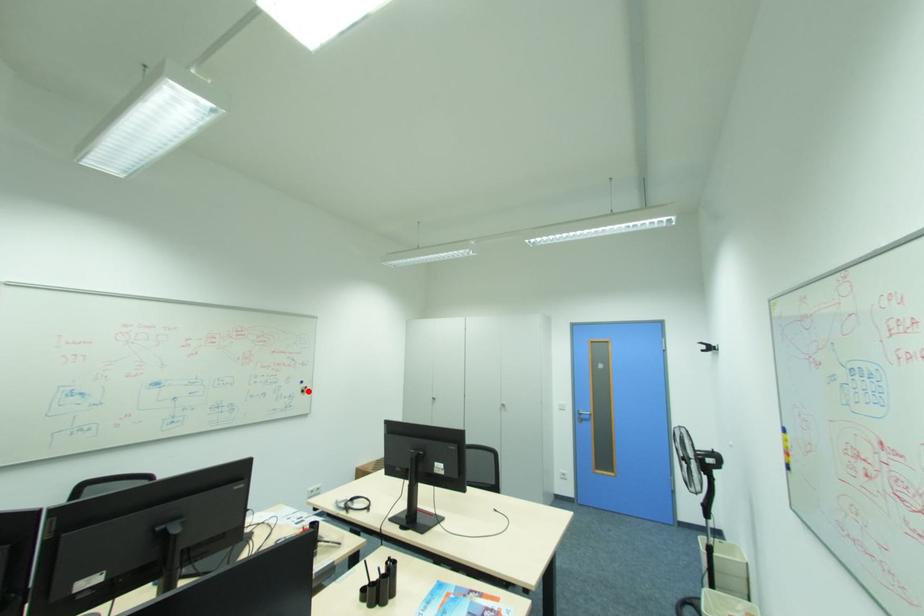
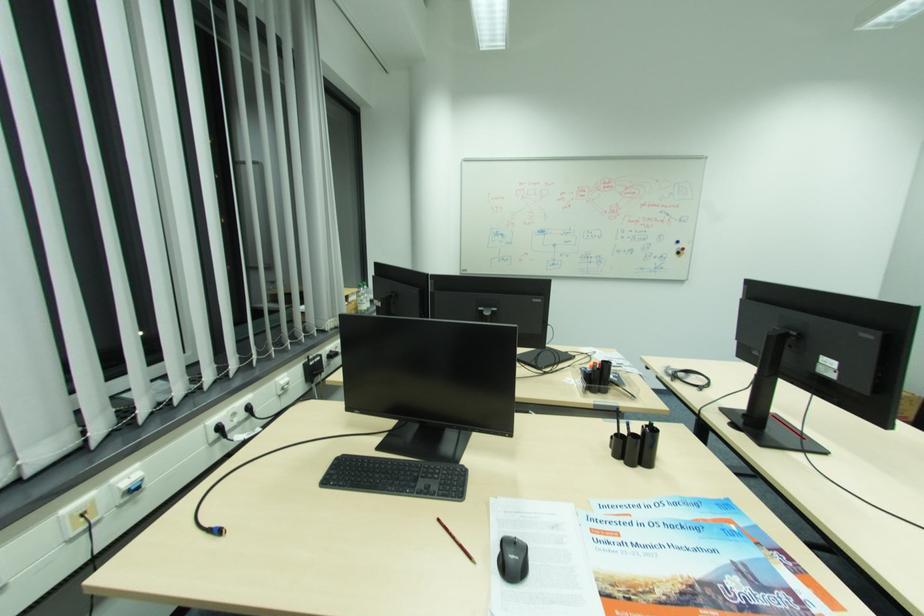
Question: I am providing you with two images of the same scene from different viewpoints. Given a red point in image1, look at the same physical point in image2. Is it:

Choices:
 (A) Closer to the viewpoint
 (B) Farther from the viewpoint

Answer: (A)